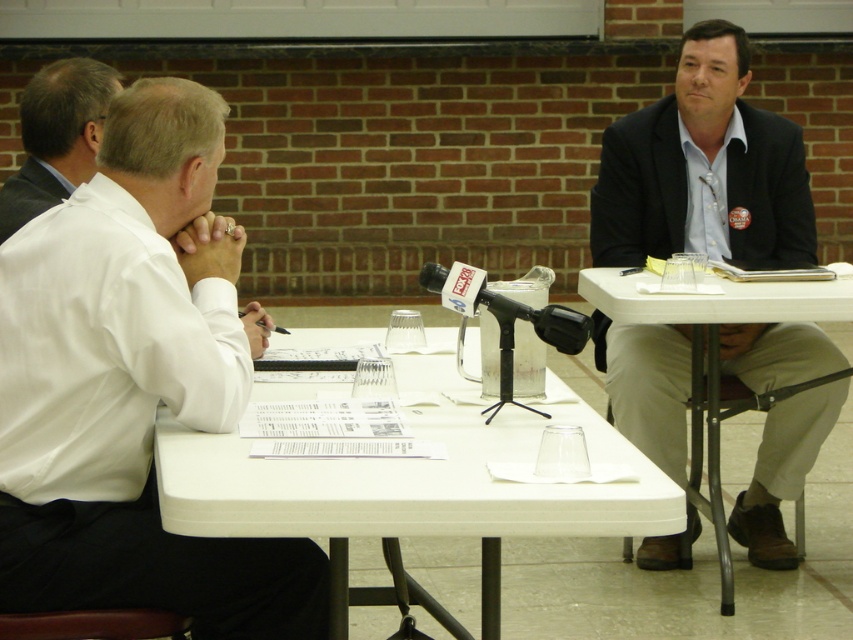
Question: Estimate the real-world distances between objects in this image. Which object is farther from the white smooth shirt at left?

Choices:
 (A) white shirt at left
 (B) white plastic table at center
 (C) dark gray suit at right

Answer: (C)

Question: Which object is the farthest from the white shirt at left?

Choices:
 (A) white smooth shirt at left
 (B) dark gray suit at right
 (C) white plastic table at center

Answer: (B)

Question: Is white shirt at left behind dark gray suit at right?

Choices:
 (A) no
 (B) yes

Answer: (A)

Question: Does white shirt at left have a smaller size compared to white smooth shirt at left?

Choices:
 (A) yes
 (B) no

Answer: (B)

Question: Among these points, which one is farthest from the camera?

Choices:
 (A) (141, 433)
 (B) (488, 509)
 (C) (115, 86)
 (D) (770, 163)

Answer: (D)

Question: In this image, where is white shirt at left located relative to white smooth shirt at left?

Choices:
 (A) above
 (B) below

Answer: (B)